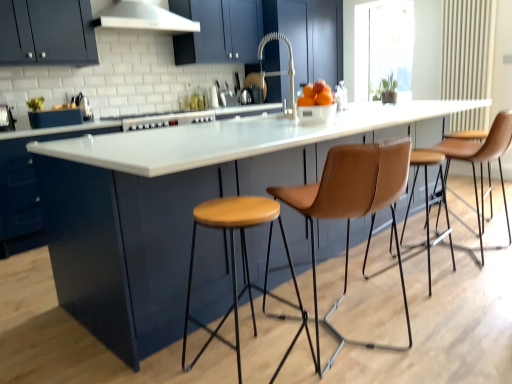
Question: In terms of width, does matte dark blue cabinet at upper left, which is the 2th cabinetry from bottom to top, look wider or thinner when compared to wooden/matte stool at center?

Choices:
 (A) wide
 (B) thin

Answer: (B)

Question: From their relative heights in the image, would you say matte dark blue cabinet at upper left, which is the 2th cabinetry from bottom to top, is taller or shorter than wooden/matte stool at center?

Choices:
 (A) tall
 (B) short

Answer: (B)

Question: Which of these objects is positioned farthest from the brushed metal toaster at left, positioned as the first appliance in left-to-right order?

Choices:
 (A) transparent glass window at upper right
 (B) polished stainless steel kettle at upper left, which is counted as the 1th appliance, starting from the back
 (C) white matte faucet at center
 (D) white glossy table at center
 (E) orange matte at center

Answer: (A)

Question: Which object is the farthest from the white glossy table at center?

Choices:
 (A) white glossy stove at center
 (B) orange matte at center
 (C) transparent glass window at upper right
 (D) tan leather stool at center, the first chair viewed from the left
 (E) white matte exhaust hood at upper center

Answer: (C)